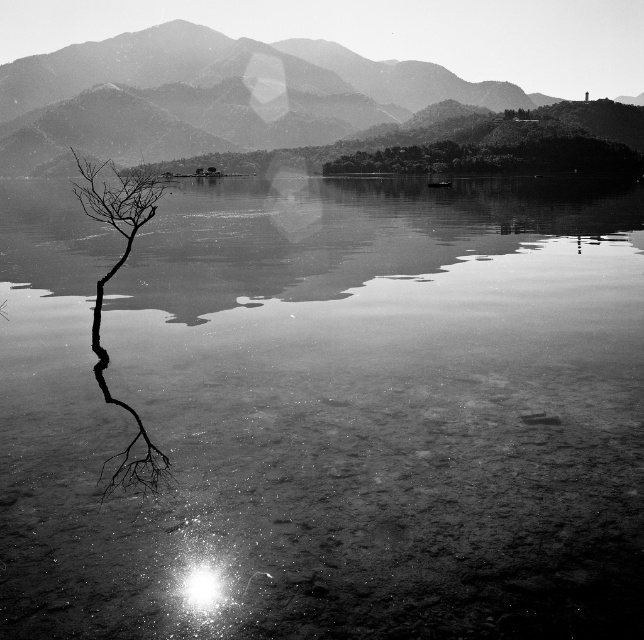
Question: Does smooth stone mountain at upper center appear under black matte tree at left?

Choices:
 (A) yes
 (B) no

Answer: (B)

Question: Is smooth water at center wider than smooth stone mountain at upper center?

Choices:
 (A) no
 (B) yes

Answer: (A)

Question: Which is nearer to the smooth stone mountain at upper center?

Choices:
 (A) smooth water at center
 (B) black matte tree at left

Answer: (B)

Question: Can you confirm if smooth water at center is positioned below black matte tree at left?

Choices:
 (A) yes
 (B) no

Answer: (A)

Question: Which is nearer to the smooth stone mountain at upper center?

Choices:
 (A) black matte tree at left
 (B) smooth water at center

Answer: (A)

Question: Which object is farther from the camera taking this photo?

Choices:
 (A) smooth stone mountain at upper center
 (B) smooth water at center
 (C) black matte tree at left

Answer: (A)